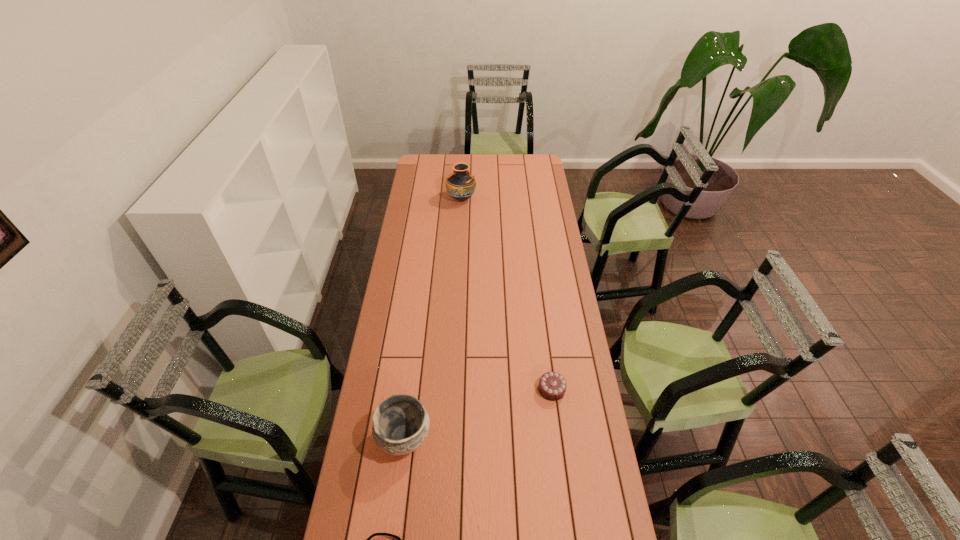
Locate an element on the screen. This screenshot has height=540, width=960. object present at the right edge is located at coordinates (552, 386).

Find the location of a particular element. free space at the far edge of the desktop is located at coordinates click(x=443, y=171).

The height and width of the screenshot is (540, 960). I want to click on vacant space at the left edge of the desktop, so click(412, 299).

At what (x,y) coordinates should I click in order to perform the action: click on vacant space at the right edge. Please return your answer as a coordinate pair (x, y). The width and height of the screenshot is (960, 540). Looking at the image, I should click on (528, 204).

I want to click on free space between the second tallest object and the tallest object, so click(433, 318).

Identify the location of unoccupied area between the second tallest object and the farthest object. (433, 318).

The height and width of the screenshot is (540, 960). Identify the location of vacant space that's between the farthest object and the second tallest object. (433, 318).

The width and height of the screenshot is (960, 540). I want to click on free spot between the third tallest object and the nearer pottery, so click(x=478, y=413).

The height and width of the screenshot is (540, 960). In order to click on vacant area that lies between the chocolate cake and the farthest object in this screenshot , I will do `click(507, 294)`.

Locate which object ranks third in proximity to the second shortest object. Please provide its 2D coordinates. Your answer should be formatted as a tuple, i.e. [(x, y)], where the tuple contains the x and y coordinates of a point satisfying the conditions above.

[(460, 185)]